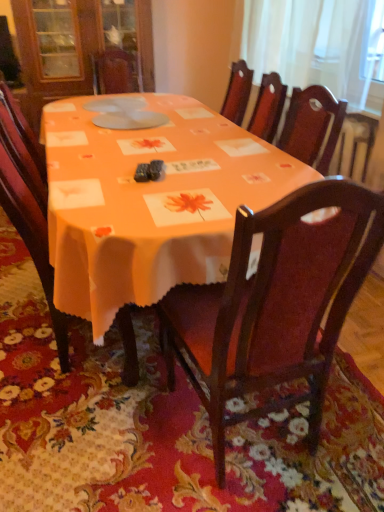
Question: Relative to wooden chair at center, the 2th chair when ordered from left to right, is white sheer curtain at upper right in front or behind?

Choices:
 (A) front
 (B) behind

Answer: (B)

Question: In terms of width, does white sheer curtain at upper right look wider or thinner when compared to wooden chair at center, the first chair when ordered from right to left?

Choices:
 (A) wide
 (B) thin

Answer: (B)

Question: Which object is the farthest from the white sheer curtain at upper right?

Choices:
 (A) wooden chair at center, marked as the 1th chair in a left-to-right arrangement
 (B) orange fabric table at center
 (C) wooden chair at center, the first chair when ordered from right to left

Answer: (A)

Question: Which object is positioned farthest from the orange fabric table at center?

Choices:
 (A) wooden chair at center, the 2th chair viewed from the right
 (B) wooden chair at center, the first chair when ordered from right to left
 (C) white sheer curtain at upper right

Answer: (C)